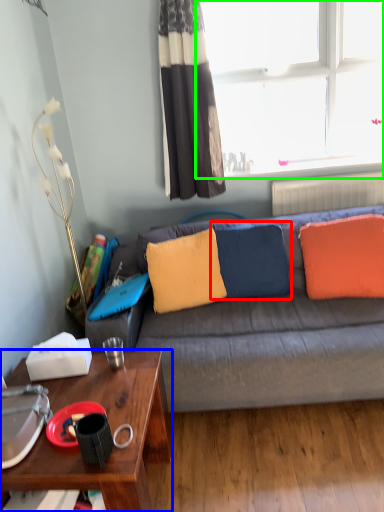
Question: Estimate the real-world distances between objects in this image. Which object is farther from pillow (highlighted by a red box), desk (highlighted by a blue box) or window (highlighted by a green box)?

Choices:
 (A) desk
 (B) window

Answer: (B)